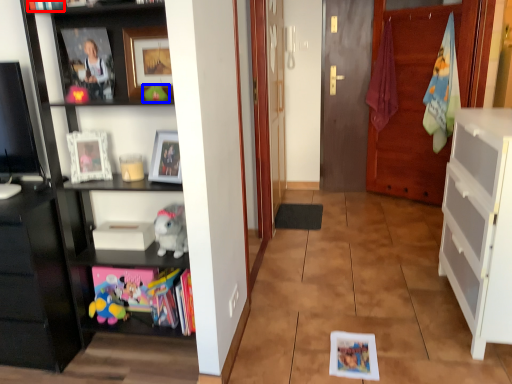
Question: Which object appears farthest to the camera in this image, book (highlighted by a red box) or toy (highlighted by a blue box)?

Choices:
 (A) book
 (B) toy

Answer: (B)